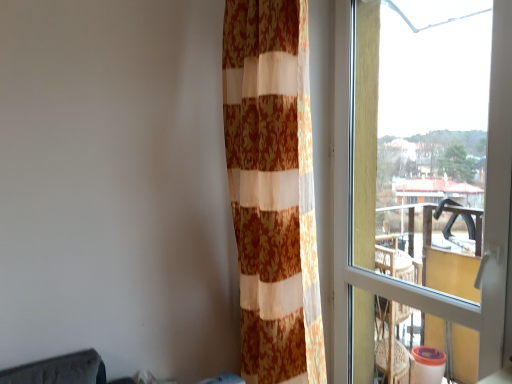
Question: From the image's perspective, is transparent glass window at right over orange floral fabric curtain at center?

Choices:
 (A) yes
 (B) no

Answer: (B)

Question: Is transparent glass window at right smaller than orange floral fabric curtain at center?

Choices:
 (A) yes
 (B) no

Answer: (A)

Question: Is transparent glass window at right turned away from orange floral fabric curtain at center?

Choices:
 (A) yes
 (B) no

Answer: (B)

Question: From a real-world perspective, is transparent glass window at right below orange floral fabric curtain at center?

Choices:
 (A) yes
 (B) no

Answer: (A)

Question: Does transparent glass window at right have a larger size compared to orange floral fabric curtain at center?

Choices:
 (A) yes
 (B) no

Answer: (B)

Question: Can you confirm if transparent glass window at right is taller than orange floral fabric curtain at center?

Choices:
 (A) yes
 (B) no

Answer: (B)

Question: From the image's perspective, is orange floral fabric curtain at center over transparent glass window at right?

Choices:
 (A) yes
 (B) no

Answer: (A)

Question: Does orange floral fabric curtain at center appear on the left side of transparent glass window at right?

Choices:
 (A) no
 (B) yes

Answer: (B)

Question: Does orange floral fabric curtain at center turn towards transparent glass window at right?

Choices:
 (A) yes
 (B) no

Answer: (B)

Question: Is orange floral fabric curtain at center bigger than transparent glass window at right?

Choices:
 (A) yes
 (B) no

Answer: (A)

Question: From a real-world perspective, is orange floral fabric curtain at center located higher than transparent glass window at right?

Choices:
 (A) no
 (B) yes

Answer: (B)

Question: From the image's perspective, does orange floral fabric curtain at center appear lower than transparent glass window at right?

Choices:
 (A) yes
 (B) no

Answer: (B)

Question: Is transparent glass window at right taller or shorter than orange floral fabric curtain at center?

Choices:
 (A) short
 (B) tall

Answer: (A)